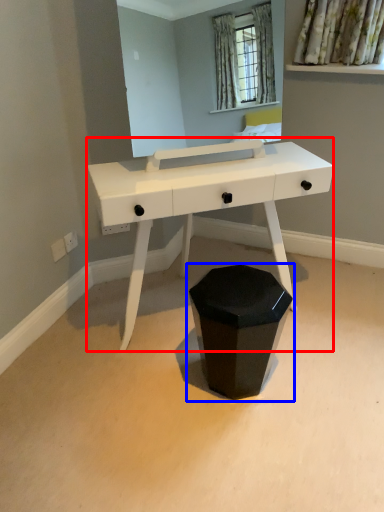
Question: Which object is further to the camera taking this photo, table (highlighted by a red box) or waste container (highlighted by a blue box)?

Choices:
 (A) table
 (B) waste container

Answer: (B)